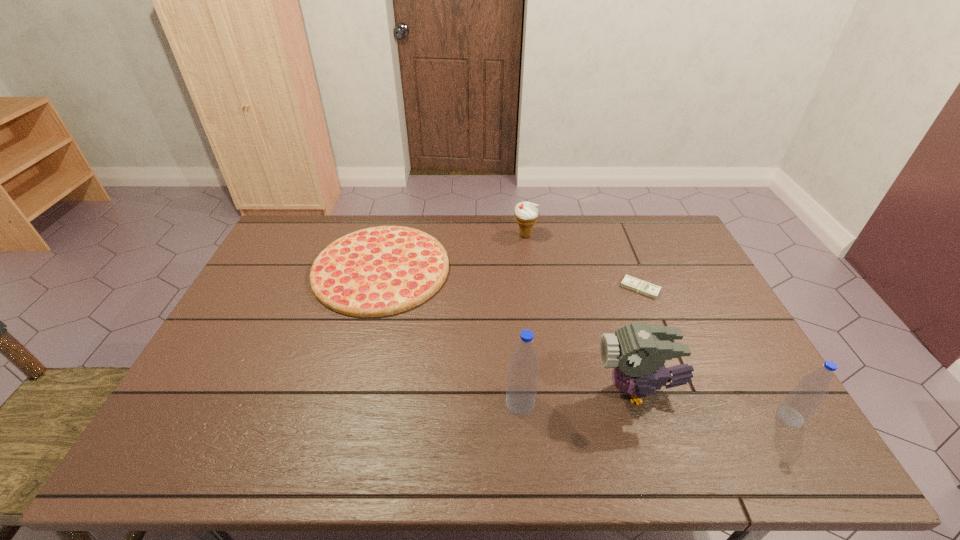
Find the location of `the taller water bottle`. the taller water bottle is located at coordinates (522, 380).

The width and height of the screenshot is (960, 540). What are the coordinates of `the tallest object` in the screenshot? It's located at (522, 380).

Where is `the shorter water bottle`? The image size is (960, 540). the shorter water bottle is located at coordinates (804, 399).

Find the location of a particular element. the rightmost object is located at coordinates (804, 399).

The width and height of the screenshot is (960, 540). I want to click on the third shortest object, so click(526, 213).

Find the location of a particular element. This screenshot has width=960, height=540. the fifth tallest object is located at coordinates (380, 271).

The width and height of the screenshot is (960, 540). I want to click on pizza, so click(x=380, y=271).

The height and width of the screenshot is (540, 960). I want to click on the shortest object, so click(x=629, y=282).

Where is `bird`? Image resolution: width=960 pixels, height=540 pixels. bird is located at coordinates (637, 352).

The image size is (960, 540). Identify the location of free region located 0.380m on the right of the tallest object. (688, 402).